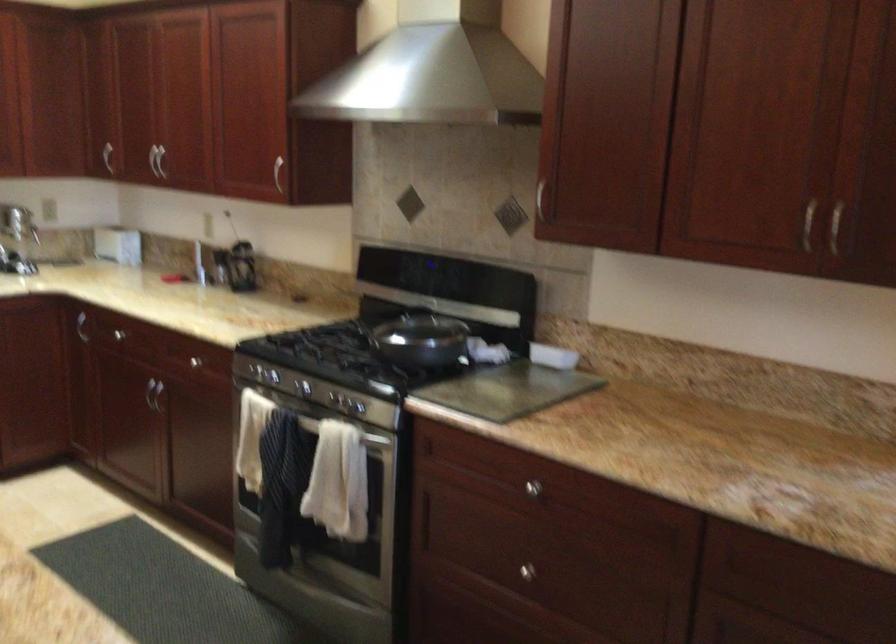
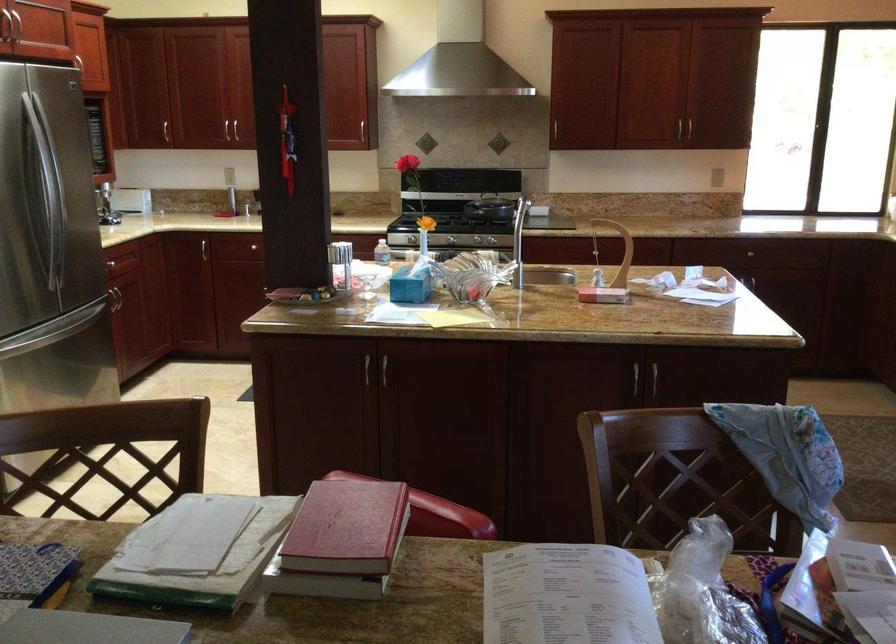
Where in the second image is the point corresponding to point (216, 175) from the first image?

(231, 131)